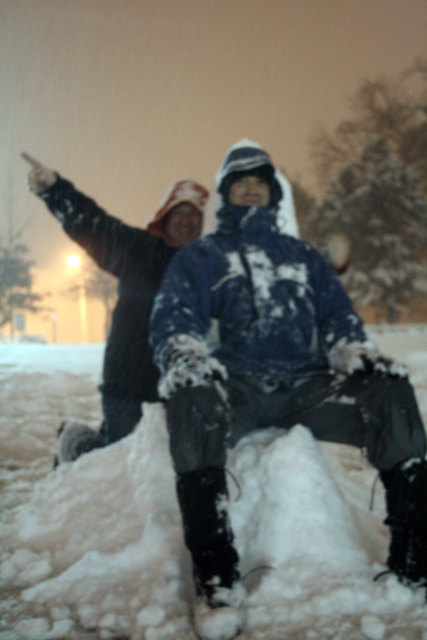
Is snow-covered jacket at center to the right of dark blue snow-covered jacket at left from the viewer's perspective?

Yes, snow-covered jacket at center is to the right of dark blue snow-covered jacket at left.

Where is `snow-covered jacket at center`? The height and width of the screenshot is (640, 427). snow-covered jacket at center is located at coordinates (271, 378).

The image size is (427, 640). I want to click on snow-covered jacket at center, so click(x=271, y=378).